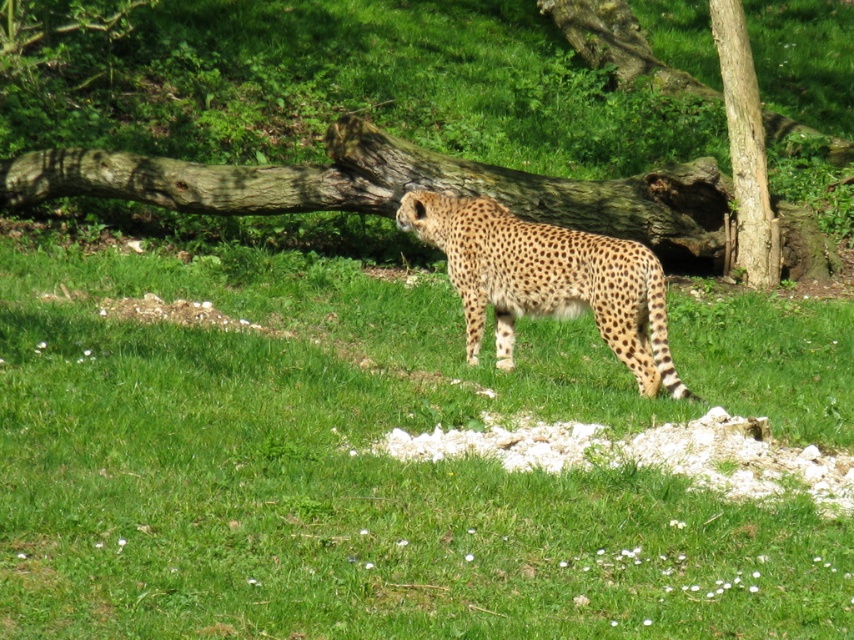
Who is shorter, green grassy at center or spotted fur cheetah at center?

Standing shorter between the two is green grassy at center.

Where is `green grassy at center`? The width and height of the screenshot is (854, 640). green grassy at center is located at coordinates (348, 474).

You are a GUI agent. You are given a task and a screenshot of the screen. Output one action in this format:
    pyautogui.click(x=<x>, y=<y>)
    Task: Click on the green grassy at center
    This screenshot has width=854, height=640.
    Given the screenshot: What is the action you would take?
    pyautogui.click(x=348, y=474)

Does spotted fur cheetah at center have a greater height compared to brown rough bark tree at right?

No, spotted fur cheetah at center is not taller than brown rough bark tree at right.

Who is shorter, spotted fur cheetah at center or brown rough bark tree at right?

With less height is spotted fur cheetah at center.

Who is more distant from viewer, (636, 376) or (728, 67)?

Point (728, 67)

Where is `spotted fur cheetah at center`? The height and width of the screenshot is (640, 854). spotted fur cheetah at center is located at coordinates (547, 280).

Is green grassy at center bigger than brown rough bark tree at right?

No.

Is green grassy at center smaller than brown rough bark tree at right?

Correct, green grassy at center occupies less space than brown rough bark tree at right.

Who is more distant from viewer, [173,342] or [755,161]?

Point [755,161]

Identify the location of green grassy at center. This screenshot has height=640, width=854. (348, 474).